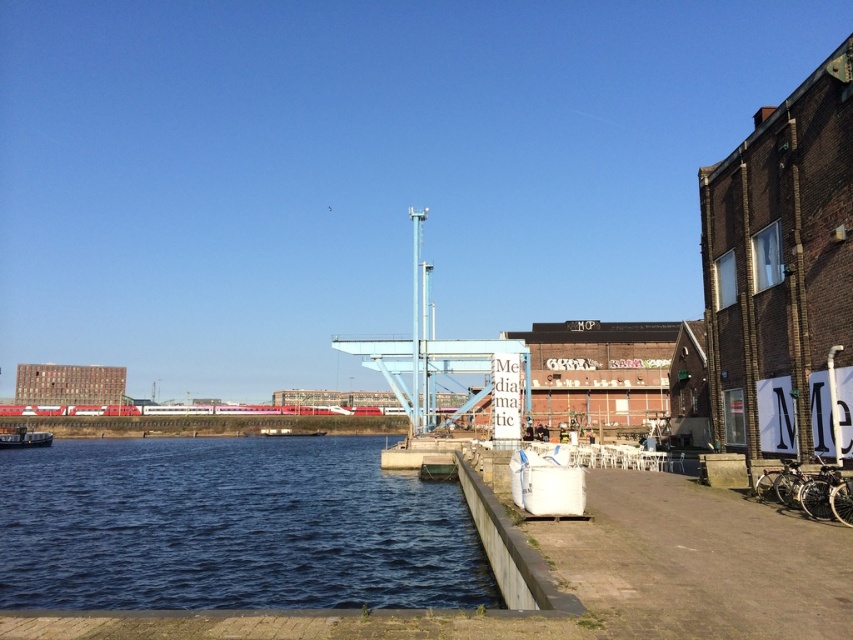
You are standing at the waterfront and want to take a photo of both the blue water at lower left and the metallic silver boat at lower left. Since you want to include both in the frame, which object should you position closer to the edge of the photo to ensure both fit?

Since the blue water at lower left is wider than the metallic silver boat at lower left, you should position the metallic silver boat at lower left closer to the edge of the photo to ensure both fit within the frame.

You are a photographer wanting to capture the blue water at lower left and the metallic silver boat at lower left in a single frame. Based on the scene, which object will occupy more of the photo?

The blue water at lower left is larger in size than the metallic silver boat at lower left, so it will occupy more of the photo.